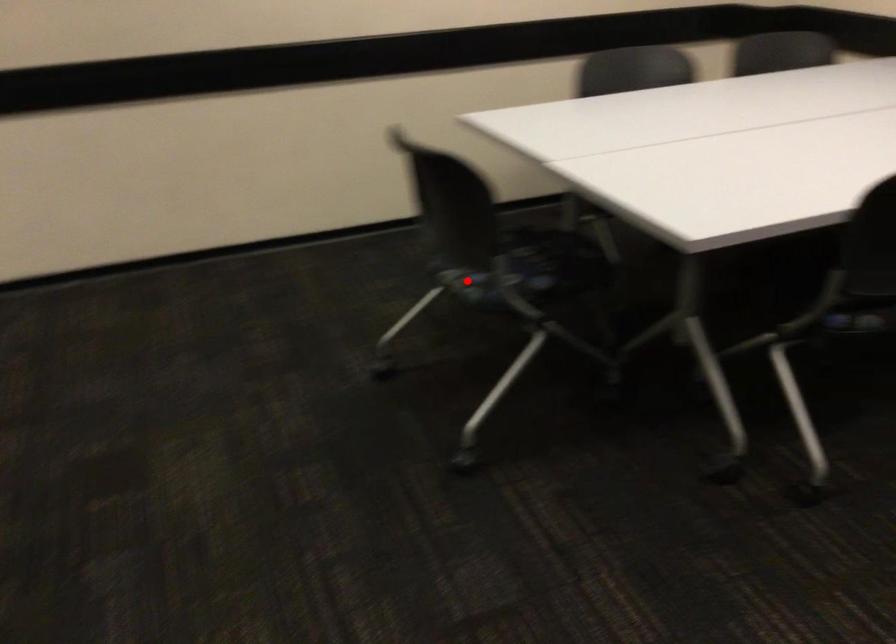
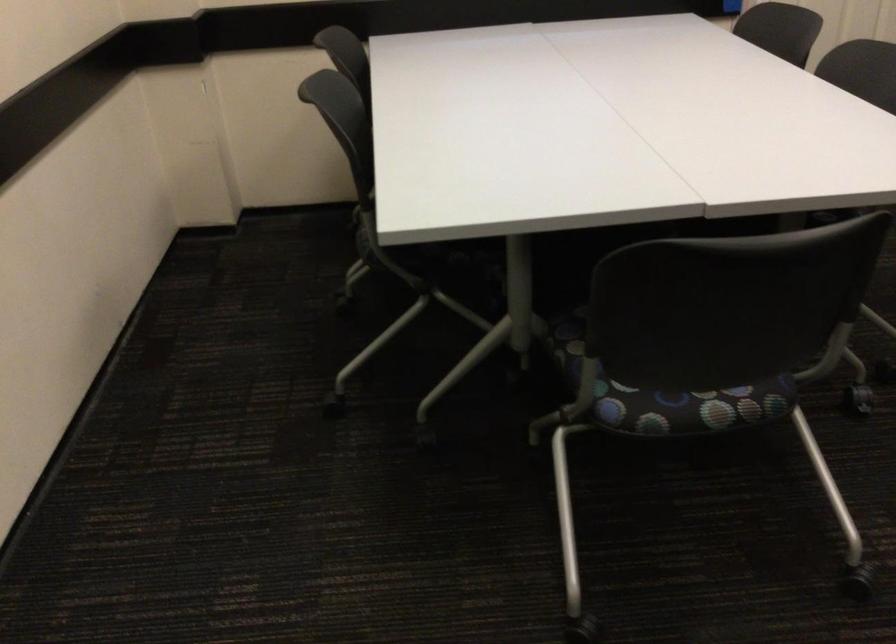
Question: I am providing you with two images of the same scene from different viewpoints. A red point is shown in image1. For the corresponding object point in image2, is it positioned nearer or farther from the camera?

Choices:
 (A) Nearer
 (B) Farther

Answer: (A)